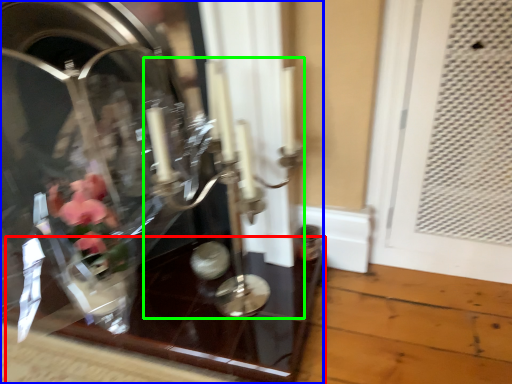
Question: Based on their relative distances, which object is nearer to glass table (highlighted by a red box)? Choose from glass box (highlighted by a blue box) and candle holder (highlighted by a green box).

Choices:
 (A) glass box
 (B) candle holder

Answer: (A)